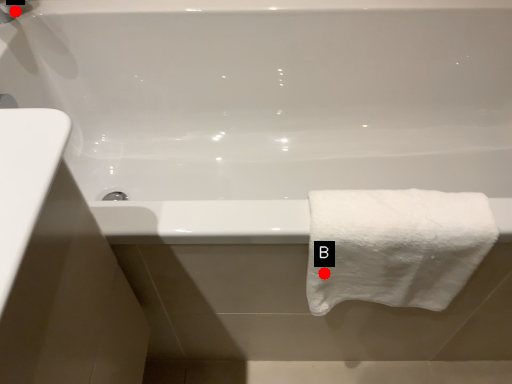
Question: Two points are circled on the image, labeled by A and B beside each circle. Among these points, which one is nearest to the camera?

Choices:
 (A) A is closer
 (B) B is closer

Answer: (B)